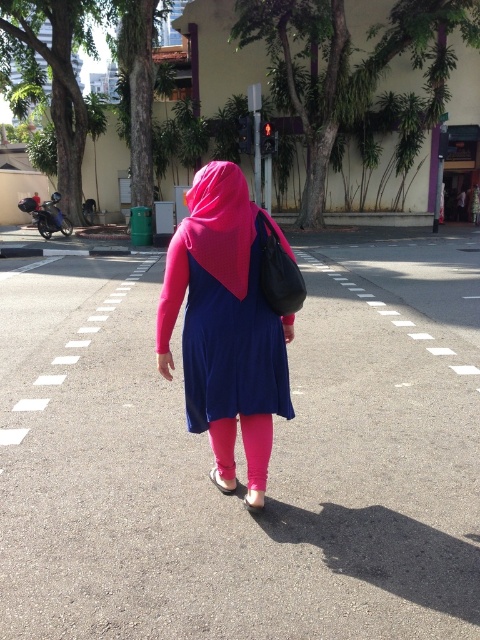
You are standing at the point marked as point (231, 348) in the image. What is the color of the clothing item you are currently touching?

The point (231, 348) is on the matte blue dress at center, so the color of the clothing item you are currently touching is blue.

You are a fashion designer observing the pedestrian crossing scene. You notice the matte blue dress at center and the pink matte headscarf at center. Which piece of clothing is located lower on the person?

The matte blue dress at center is positioned under the pink matte headscarf at center, so the dress is lower on the person.

You are standing on a pedestrian crossing and see a person wearing a matte pink dress at center and pink fabric pants at center. Which clothing item is more to the left?

The matte pink dress at center is more to the left because it is positioned on the left side of the pink fabric pants at center.